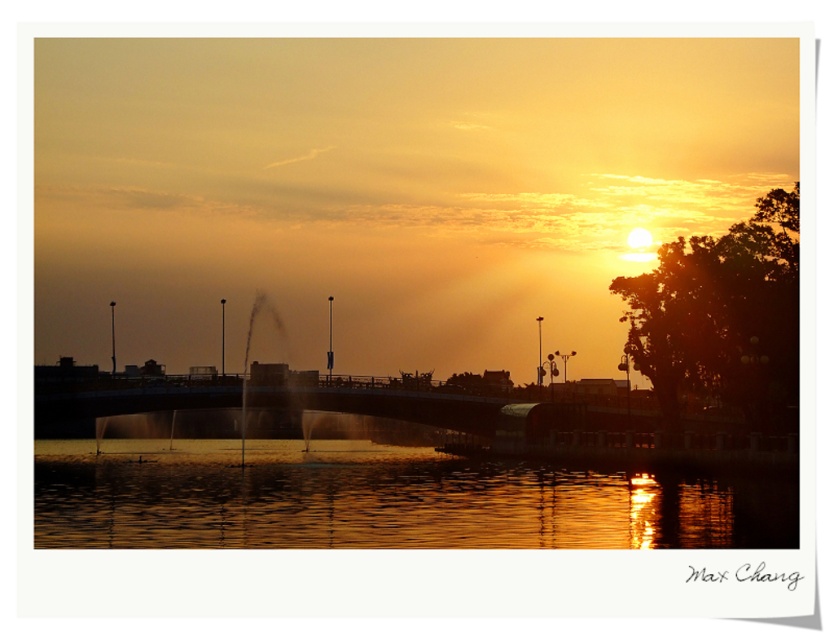
You are standing on the shore of the lake and see the shiny reflective water at center and the metallic bridge at center. Which object is closer to the ground?

The shiny reflective water at center is closer to the ground as it is positioned below the metallic bridge at center.

You are standing on the shore of the lake and see the shiny reflective water at center and the metallic bridge at center. Which object is nearer to you?

The shiny reflective water at center is closer to the viewer than the metallic bridge at center.